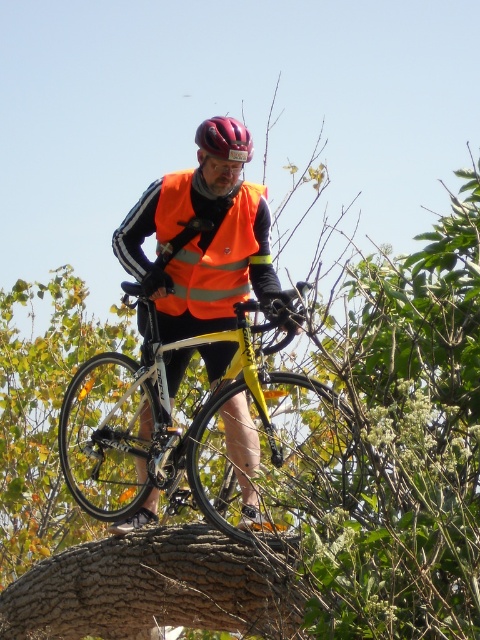
Based on the photo, you are a hiker trying to cross a tree trunk. You see the point marked at coordinate (155, 588). What is the object located at that point?

The point at coordinate (155, 588) indicates a brown rough tree trunk at center.

You are standing at the point with coordinates (206, 435). Looking around, what object are you at the center of?

The yellow matte bicycle at center is represented by point (206, 435), so you are at the center of the yellow matte bicycle at center.

You are a drone operator trying to capture a photo of the cyclist in the scene. The drone has a minimum focus distance of 35 feet. Will the orange reflective vest at center be in focus?

The orange reflective vest at center is 37.66 feet away from the camera, which is beyond the drone operator minimum focus distance of 35 feet. Therefore, the orange reflective vest at center will be in focus.